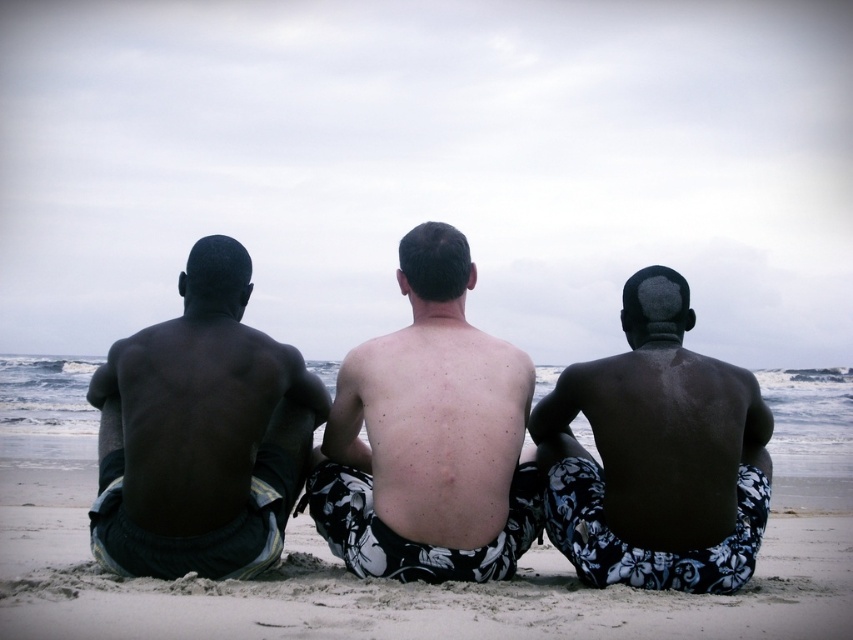
What is the 2D coordinate of the sandy beach at center in the image?

The sandy beach at center is located at the 2D coordinate point of (399, 582).

You are a photographer trying to capture a wide shot of the scene. Since the sandy beach at center is wider than the dark skin textured shorts at center, will the beach take up more space in the photo than the shorts?

Yes, the sandy beach at center is wider than the dark skin textured shorts at center, so it will occupy more space in the photo.